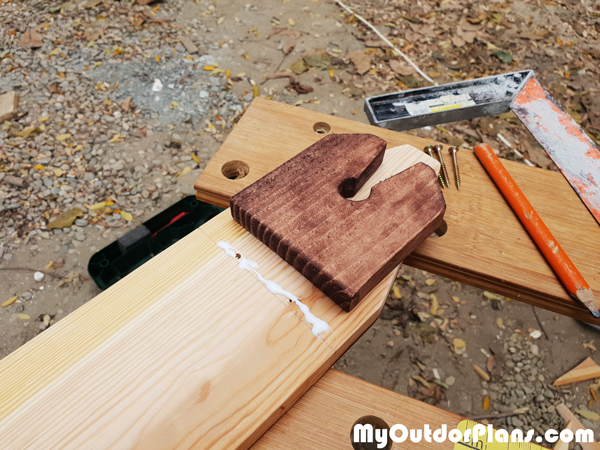
In order to click on light wood element in this screenshot , I will do `click(199, 337)`.